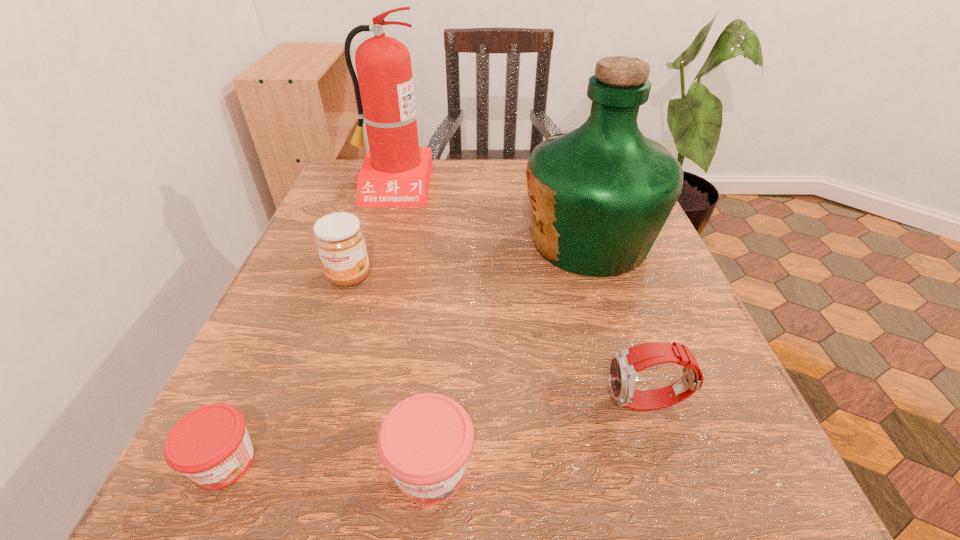
Locate an element on the screen. This screenshot has height=540, width=960. free space located 0.260m on the label side of the liquor is located at coordinates (393, 241).

The height and width of the screenshot is (540, 960). Find the location of `vacant space located 0.280m on the front label of the farthest jam`. vacant space located 0.280m on the front label of the farthest jam is located at coordinates (294, 438).

Identify the location of vacant region located on the face of the fourth farthest object. The width and height of the screenshot is (960, 540). (550, 403).

The height and width of the screenshot is (540, 960). Identify the location of free space located 0.350m on the face of the fourth farthest object. (354, 403).

Find the location of a particular element. This screenshot has width=960, height=540. free region located 0.110m on the face of the fourth farthest object is located at coordinates (529, 403).

Find the location of a particular element. This screenshot has width=960, height=540. fire extinguisher that is at the far edge is located at coordinates (396, 172).

Locate an element on the screen. Image resolution: width=960 pixels, height=540 pixels. liquor positioned at the far edge is located at coordinates (599, 195).

Locate an element on the screen. fire extinguisher that is at the left edge is located at coordinates (396, 172).

Where is `liquor present at the right edge`? The height and width of the screenshot is (540, 960). liquor present at the right edge is located at coordinates (599, 195).

The image size is (960, 540). Find the location of `watch at the right edge`. watch at the right edge is located at coordinates (625, 364).